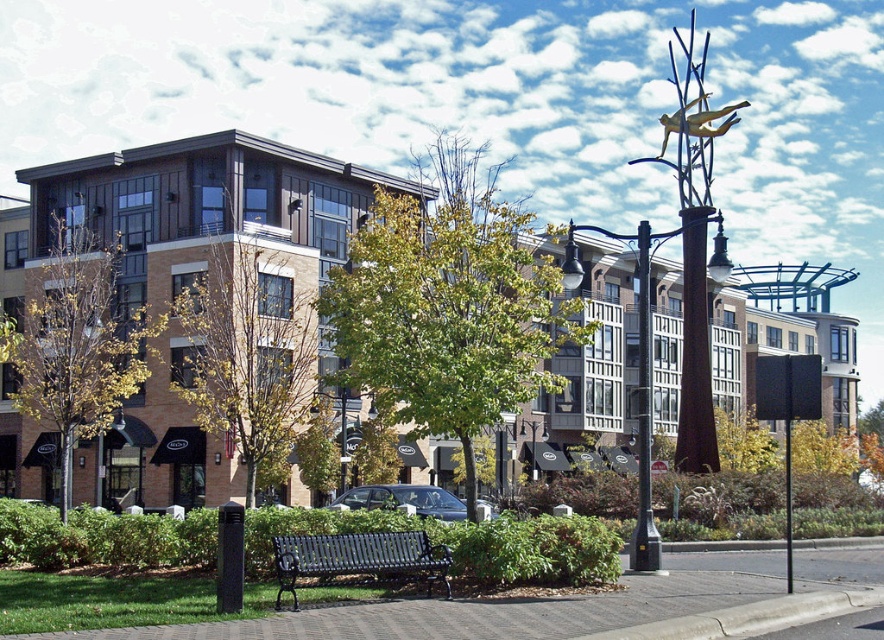
Question: Among these points, which one is nearest to the camera?

Choices:
 (A) (637, 554)
 (B) (496, 216)
 (C) (761, 592)

Answer: (C)

Question: Which point appears closest to the camera in this image?

Choices:
 (A) (357, 365)
 (B) (89, 360)
 (C) (402, 547)
 (D) (692, 380)

Answer: (C)

Question: Can you confirm if green leafy tree at center is positioned below brown textured tree at center?

Choices:
 (A) no
 (B) yes

Answer: (A)

Question: Can you confirm if brown textured tree at center is positioned above polished metal pole at center?

Choices:
 (A) yes
 (B) no

Answer: (B)

Question: Which point is closer to the camera?

Choices:
 (A) brown leafy tree at left
 (B) brick pavement at center
 (C) bronze textured pole at center

Answer: (B)

Question: Where is brick pavement at center located in relation to brown textured tree at center in the image?

Choices:
 (A) below
 (B) above

Answer: (A)